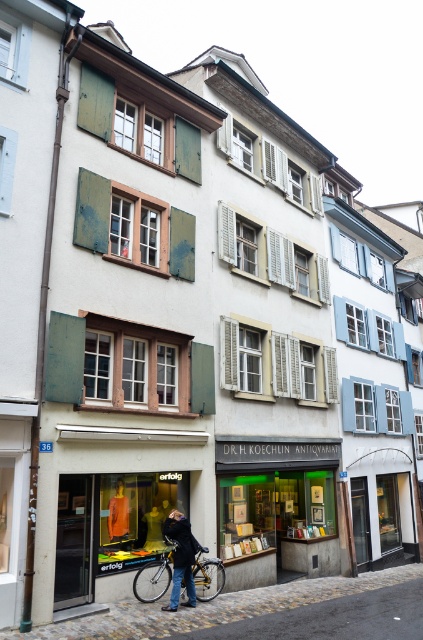
You are a delivery person trying to park your silver metallic bicycle at center next to the dark blue leather jacket at center in this European style building. Considering their sizes, will the bicycle fit without overlapping the jacket?

The silver metallic bicycle at center is narrower than the dark blue leather jacket at center, so it should fit without overlapping the jacket.

You are a delivery person who needs to load both the silver metallic bicycle at center and the dark blue leather jacket at center into your truck. The truck has a loading ramp that can only accommodate one item at a time. Based on their positions relative to each other, which item should you load first to avoid blocking access to the other?

You should load the dark blue leather jacket at center first because the silver metallic bicycle at center is positioned to its right. By loading the jacket first, you can then easily access and load the bicycle without obstruction.

You are standing in front of the building and see the silver metallic bicycle at center and the dark blue leather jacket at center. Which object is closer to you?

The silver metallic bicycle at center is closer to you because the dark blue leather jacket at center is behind it.